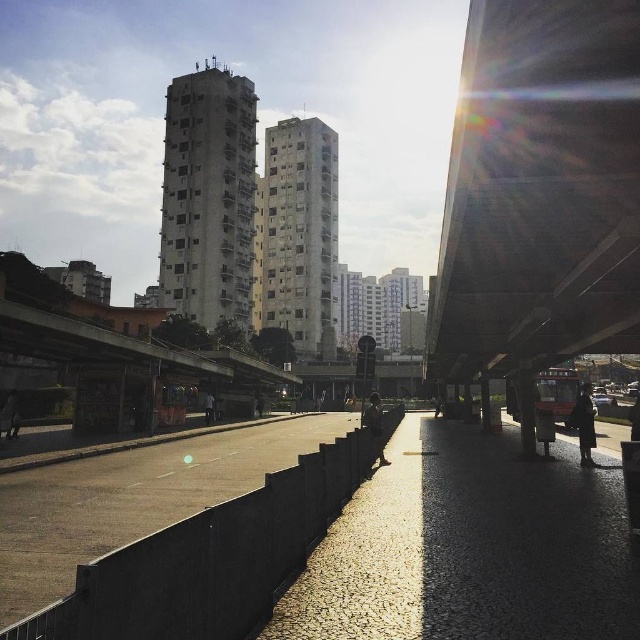
Question: Which object is positioned farthest from the dark gray fabric jacket at lower left?

Choices:
 (A) dark gray fabric jacket at center
 (B) dark gray concrete person at center
 (C) dark brown leather jacket at center

Answer: (A)

Question: Does dark brown leather coat at lower right have a larger size compared to dark gray concrete person at center?

Choices:
 (A) yes
 (B) no

Answer: (A)

Question: Does dark gray fabric jacket at lower left appear on the right side of dark gray fabric jacket at center?

Choices:
 (A) no
 (B) yes

Answer: (A)

Question: Which point appears closest to the camera in this image?

Choices:
 (A) (12, 412)
 (B) (205, 413)
 (C) (433, 403)

Answer: (A)

Question: Which object appears closest to the camera in this image?

Choices:
 (A) dark gray fabric jacket at center
 (B) dark gray concrete person at center

Answer: (B)

Question: Does dark gray fabric jacket at lower left have a lesser width compared to dark gray concrete person at center?

Choices:
 (A) yes
 (B) no

Answer: (A)